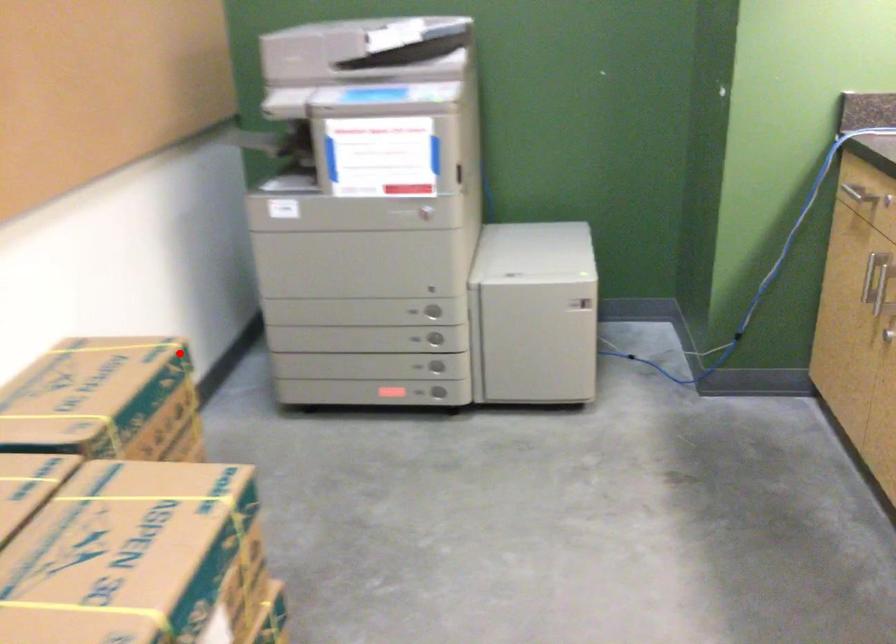
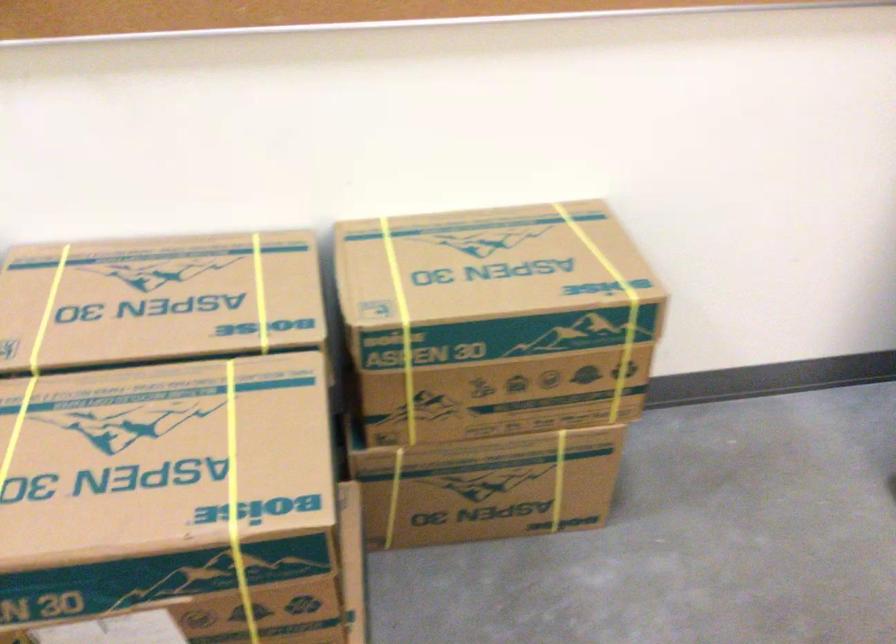
Question: A red point is marked in image1. In image2, is the corresponding 3D point closer to the camera or farther? Reply with the corresponding letter.

Choices:
 (A) The corresponding 3D point is closer.
 (B) The corresponding 3D point is farther.

Answer: (A)